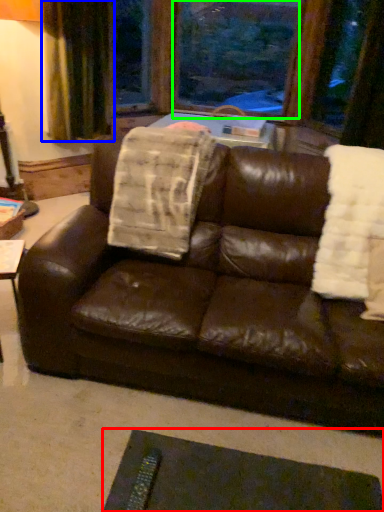
Question: Based on their relative distances, which object is nearer to flat (highlighted by a red box)? Choose from curtain (highlighted by a blue box) and window screen (highlighted by a green box).

Choices:
 (A) curtain
 (B) window screen

Answer: (A)